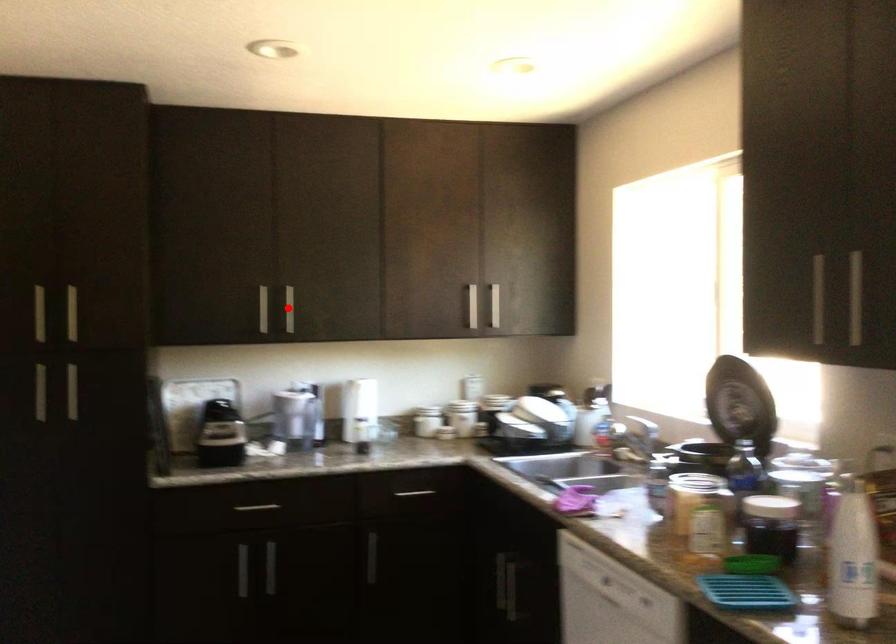
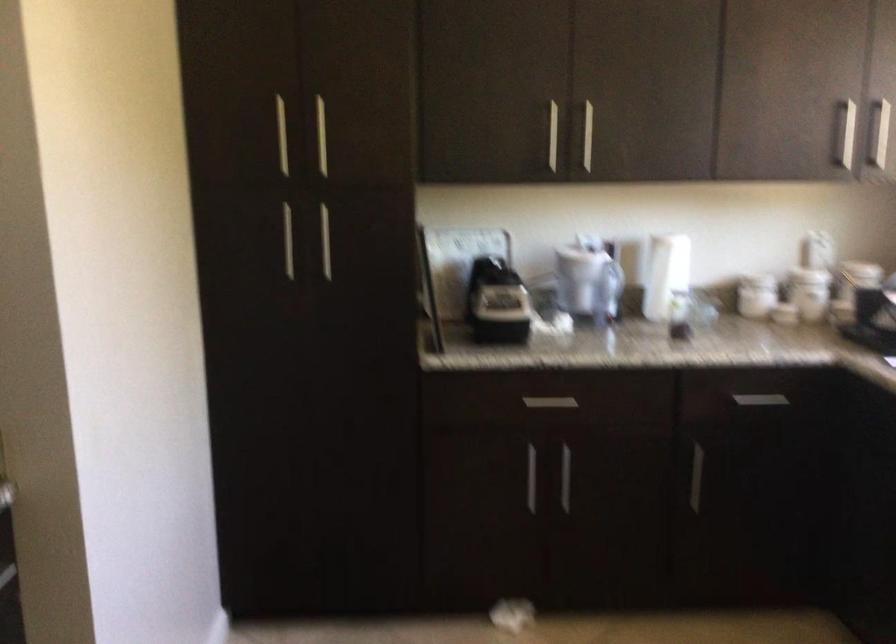
Locate, in the second image, the point that corresponds to the highlighted location in the first image.

(588, 136)